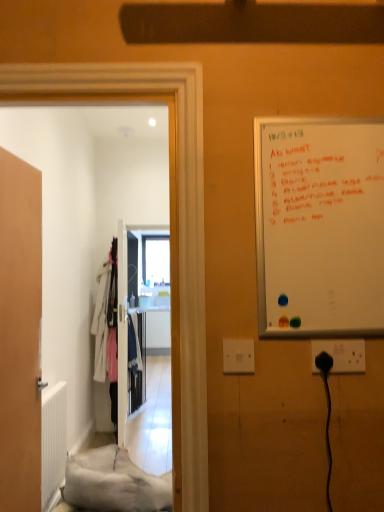
Question: Is metallic silver clothes at center taller or shorter than wooden door at left?

Choices:
 (A) tall
 (B) short

Answer: (B)

Question: Is metallic silver clothes at center inside the boundaries of wooden door at left, or outside?

Choices:
 (A) outside
 (B) inside

Answer: (A)

Question: Which of these objects is positioned closest to the wooden door at left?

Choices:
 (A) white carpet at lower left
 (B) whiteboard at right
 (C) metallic silver clothes at center
 (D) black plastic socket at lower right, the second electric outlet from the left
 (E) white matte radiator at lower left

Answer: (A)

Question: Estimate the real-world distances between objects in this image. Which object is closer to the black plastic socket at lower right, the second electric outlet from the left?

Choices:
 (A) whiteboard at right
 (B) wooden door at left
 (C) white matte radiator at lower left
 (D) metallic silver clothes at center
 (E) white carpet at lower left

Answer: (A)